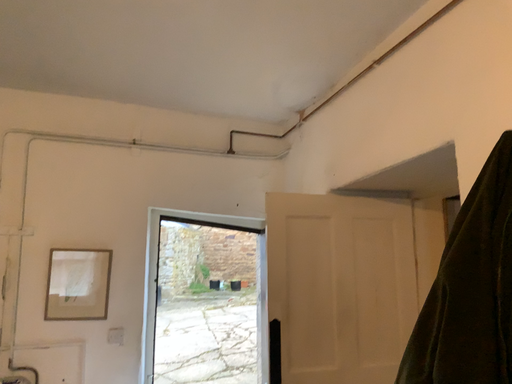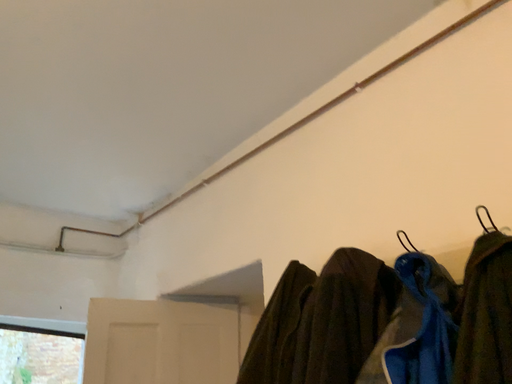
Question: Which way did the camera rotate in the video?

Choices:
 (A) rotated upward
 (B) rotated downward

Answer: (A)